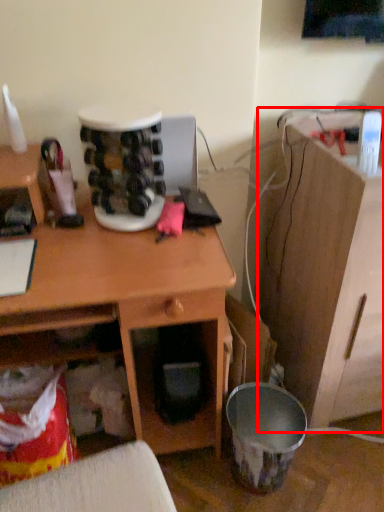
Question: From the image's perspective, what is the correct spatial positioning of computer desk (annotated by the red box) in reference to desk?

Choices:
 (A) below
 (B) above

Answer: (B)